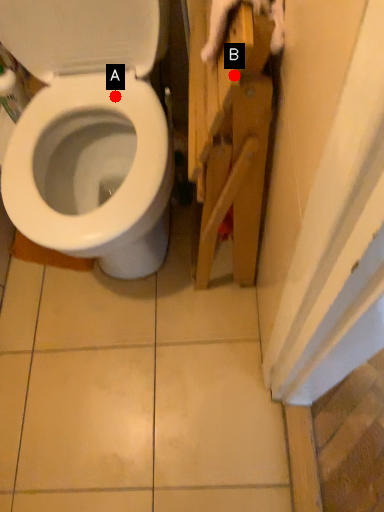
Question: Two points are circled on the image, labeled by A and B beside each circle. Which point appears farthest from the camera in this image?

Choices:
 (A) A is further
 (B) B is further

Answer: (A)